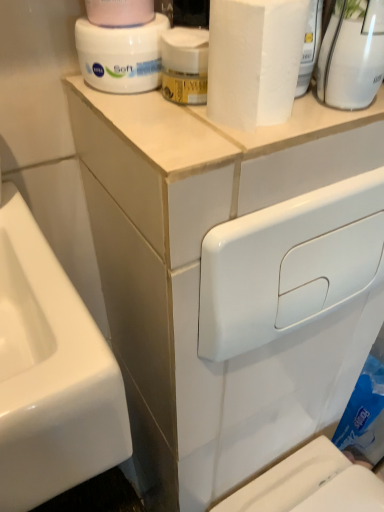
In order to face white matte paper towel at upper center, should I rotate leftwards or rightwards?

Turn right by 8.540 degrees to look at white matte paper towel at upper center.

Image resolution: width=384 pixels, height=512 pixels. I want to click on white matte paper towel at upper center, so click(x=254, y=60).

Between pink matte toilet paper at upper center and white glossy toilet tank at upper center, which one appears on the right side from the viewer's perspective?

Positioned to the right is white glossy toilet tank at upper center.

Is pink matte toilet paper at upper center facing away from white glossy toilet tank at upper center?

No, pink matte toilet paper at upper center is not facing away from white glossy toilet tank at upper center.

Is pink matte toilet paper at upper center taller than white glossy toilet tank at upper center?

No.

Based on the photo, from a real-world perspective, between pink matte toilet paper at upper center and white glossy toilet tank at upper center, who is vertically higher?

pink matte toilet paper at upper center is physically above.

Measure the distance from white glossy toilet tank at upper center to white matte paper towel at upper center.

white glossy toilet tank at upper center is 12.10 inches from white matte paper towel at upper center.

Would you consider white glossy toilet tank at upper center to be distant from white matte paper towel at upper center?

That's not correct — white glossy toilet tank at upper center is a little close to white matte paper towel at upper center.

The image size is (384, 512). In order to click on bathroom cabinet lying behind the white matte paper towel at upper center in this screenshot , I will do `click(199, 278)`.

From the image's perspective, would you say white glossy toilet tank at upper center is positioned over white matte paper towel at upper center?

No.

Would you say pink matte toilet paper at upper center is outside white matte jar at upper center, which ranks as the second cleaning product in right-to-left order?

That's correct, pink matte toilet paper at upper center is outside of white matte jar at upper center, which ranks as the second cleaning product in right-to-left order.

Does point (87, 3) appear closer or farther from the camera than point (160, 51)?

Point (87, 3) is positioned farther from the camera compared to point (160, 51).

The height and width of the screenshot is (512, 384). I want to click on toilet paper on the right of white matte jar at upper center, which ranks as the second cleaning product in right-to-left order, so click(x=119, y=12).

From a real-world perspective, which is physically above, pink matte toilet paper at upper center or white matte jar at upper center, which ranks as the second cleaning product in right-to-left order?

From a 3D spatial view, pink matte toilet paper at upper center is above.

Is white matte jar at upper center, which ranks as the second cleaning product in right-to-left order, facing towards white matte paper towel at upper center?

Yes, white matte jar at upper center, which ranks as the second cleaning product in right-to-left order, is facing white matte paper towel at upper center.

Considering the relative positions of white matte jar at upper center, marked as the first cleaning product in a left-to-right arrangement, and white matte paper towel at upper center in the image provided, is white matte jar at upper center, marked as the first cleaning product in a left-to-right arrangement, to the left or to the right of white matte paper towel at upper center?

From the image, it's evident that white matte jar at upper center, marked as the first cleaning product in a left-to-right arrangement, is to the left of white matte paper towel at upper center.

Is point (122, 56) farther from viewer compared to point (237, 48)?

Yes.

From a real-world perspective, who is located higher, white glossy vase at upper right, the 2th cleaning product viewed from the left, or white glossy toilet tank at upper center?

white glossy vase at upper right, the 2th cleaning product viewed from the left, from a real-world perspective.

From the image's perspective, would you say white glossy vase at upper right, which appears as the first cleaning product when viewed from the right, is positioned over white glossy toilet tank at upper center?

Yes, from the image's perspective, white glossy vase at upper right, which appears as the first cleaning product when viewed from the right, is over white glossy toilet tank at upper center.

Are white glossy vase at upper right, which appears as the first cleaning product when viewed from the right, and white glossy toilet tank at upper center making contact?

white glossy vase at upper right, which appears as the first cleaning product when viewed from the right, and white glossy toilet tank at upper center are not in contact.

From the image's perspective, between white matte jar at upper center, which ranks as the second cleaning product in right-to-left order, and pink matte toilet paper at upper center, who is located below?

white matte jar at upper center, which ranks as the second cleaning product in right-to-left order, from the image's perspective.

From a real-world perspective, which is physically below, white matte jar at upper center, which ranks as the second cleaning product in right-to-left order, or pink matte toilet paper at upper center?

From a 3D spatial view, white matte jar at upper center, which ranks as the second cleaning product in right-to-left order, is below.

From the pink matte toilet paper at upper center, count 2nd cleaning products backward and point to it. Please provide its 2D coordinates.

[(121, 55)]

Is white matte jar at upper center, which ranks as the second cleaning product in right-to-left order, taller or shorter than pink matte toilet paper at upper center?

In the image, white matte jar at upper center, which ranks as the second cleaning product in right-to-left order, appears to be shorter than pink matte toilet paper at upper center.

Is white matte paper towel at upper center beside white matte jar at upper center, marked as the first cleaning product in a left-to-right arrangement?

There is a gap between white matte paper towel at upper center and white matte jar at upper center, marked as the first cleaning product in a left-to-right arrangement.

Looking at the image, does white matte paper towel at upper center seem bigger or smaller compared to white matte jar at upper center, marked as the first cleaning product in a left-to-right arrangement?

In the image, white matte paper towel at upper center appears to be larger than white matte jar at upper center, marked as the first cleaning product in a left-to-right arrangement.

Is white matte paper towel at upper center to the left of white matte jar at upper center, marked as the first cleaning product in a left-to-right arrangement, from the viewer's perspective?

No.

From the image's perspective, would you say white matte paper towel at upper center is shown under white matte jar at upper center, which ranks as the second cleaning product in right-to-left order?

Yes, from the image's perspective, white matte paper towel at upper center is beneath white matte jar at upper center, which ranks as the second cleaning product in right-to-left order.

You are a GUI agent. You are given a task and a screenshot of the screen. Output one action in this format:
    pyautogui.click(x=<x>, y=<y>)
    Task: Click on the toilet paper above the white glossy toilet tank at upper center (from the image's perspective)
    This screenshot has height=512, width=384.
    Given the screenshot: What is the action you would take?
    pyautogui.click(x=119, y=12)

In the image, there is a white matte paper towel at upper center. Where is `bathroom cabinet below it (from the image's perspective)`? This screenshot has width=384, height=512. bathroom cabinet below it (from the image's perspective) is located at coordinates (199, 278).

Looking at the image, which one is located closer to white glossy toilet tank at upper center, pink matte toilet paper at upper center or white matte paper towel at upper center?

white matte paper towel at upper center.

Based on their spatial positions, is pink matte toilet paper at upper center or white matte paper towel at upper center closer to white glossy vase at upper right, which appears as the first cleaning product when viewed from the right?

The object closer to white glossy vase at upper right, which appears as the first cleaning product when viewed from the right, is white matte paper towel at upper center.

Looking at the image, which one is located closer to pink matte toilet paper at upper center, white matte paper towel at upper center or white glossy vase at upper right, the 2th cleaning product viewed from the left?

white matte paper towel at upper center.

Which object lies further to the anchor point white matte paper towel at upper center, white matte jar at upper center, which ranks as the second cleaning product in right-to-left order, or white glossy toilet tank at upper center?

The object further to white matte paper towel at upper center is white glossy toilet tank at upper center.

When comparing their distances from pink matte toilet paper at upper center, does white glossy vase at upper right, the 2th cleaning product viewed from the left, or white matte jar at upper center, which ranks as the second cleaning product in right-to-left order, seem further?

white glossy vase at upper right, the 2th cleaning product viewed from the left, is further to pink matte toilet paper at upper center.

Which object lies nearer to the anchor point white matte paper towel at upper center, white glossy vase at upper right, the 2th cleaning product viewed from the left, or pink matte toilet paper at upper center?

white glossy vase at upper right, the 2th cleaning product viewed from the left, lies closer to white matte paper towel at upper center than the other object.

Estimate the real-world distances between objects in this image. Which object is closer to white matte paper towel at upper center, pink matte toilet paper at upper center or white glossy toilet tank at upper center?

pink matte toilet paper at upper center.

Considering their positions, is white matte jar at upper center, marked as the first cleaning product in a left-to-right arrangement, positioned further to white glossy vase at upper right, the 2th cleaning product viewed from the left, than pink matte toilet paper at upper center?

pink matte toilet paper at upper center is positioned further to the anchor white glossy vase at upper right, the 2th cleaning product viewed from the left.

Find the location of a particular element. The width and height of the screenshot is (384, 512). cleaning product between white glossy vase at upper right, the 2th cleaning product viewed from the left, and white glossy toilet tank at upper center, in the vertical direction is located at coordinates (121, 55).

At what (x,y) coordinates should I click in order to perform the action: click on paper towel between white matte jar at upper center, which ranks as the second cleaning product in right-to-left order, and white glossy toilet tank at upper center, in the vertical direction. Please return your answer as a coordinate pair (x, y). This screenshot has width=384, height=512. Looking at the image, I should click on (254, 60).

Image resolution: width=384 pixels, height=512 pixels. What are the coordinates of `paper towel between white glossy vase at upper right, the 2th cleaning product viewed from the left, and white glossy toilet tank at upper center, in the vertical direction` in the screenshot? It's located at (254, 60).

Locate an element on the screen. toilet paper between white matte jar at upper center, which ranks as the second cleaning product in right-to-left order, and white glossy vase at upper right, which appears as the first cleaning product when viewed from the right, in the horizontal direction is located at coordinates (119, 12).